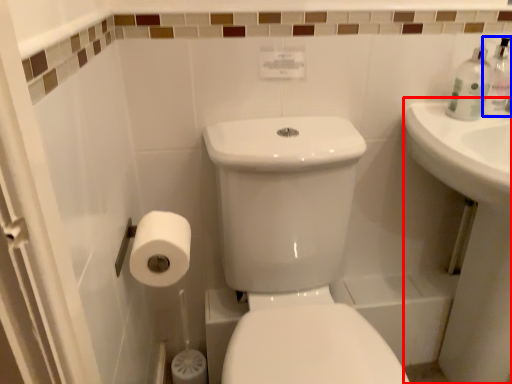
Question: Among these objects, which one is farthest to the camera, counter top (highlighted by a red box) or soap dispenser (highlighted by a blue box)?

Choices:
 (A) counter top
 (B) soap dispenser

Answer: (B)